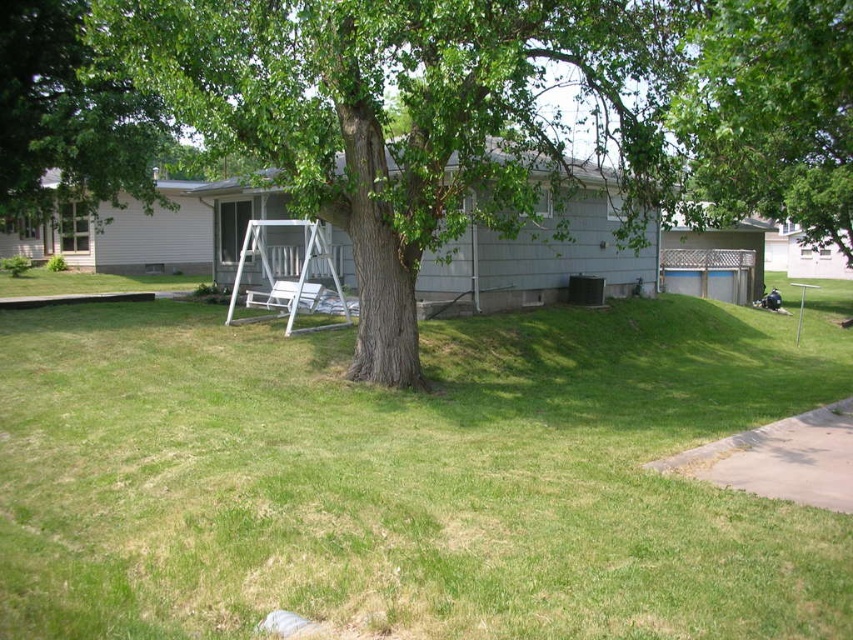
From the picture: You are planning to set up a picnic in the suburban backyard scene. You have a picnic blanket that requires a flat area where the green grass at center and white plastic chair at center are located. Considering their heights, will the ground be level enough for the blanket?

The green grass at center is taller than the white plastic chair at center, so the ground might not be perfectly level. However, since the grass is part of the ground, the overall area could still be relatively flat for placing the picnic blanket.

In the scene shown: You are standing in the backyard and want to place a small potted plant between the green grass at center and the white plastic chair at center. Based on their positions, which object should the potted plant be closer to?

The green grass at center is closer to the viewer than the white plastic chair at center, so the potted plant should be placed closer to the white plastic chair at center to maintain a balanced distance between both objects.